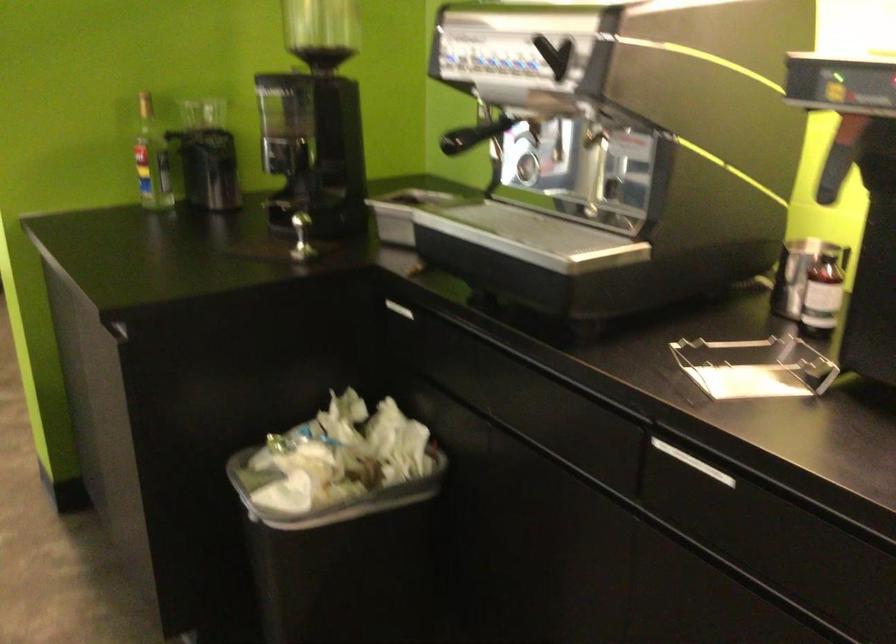
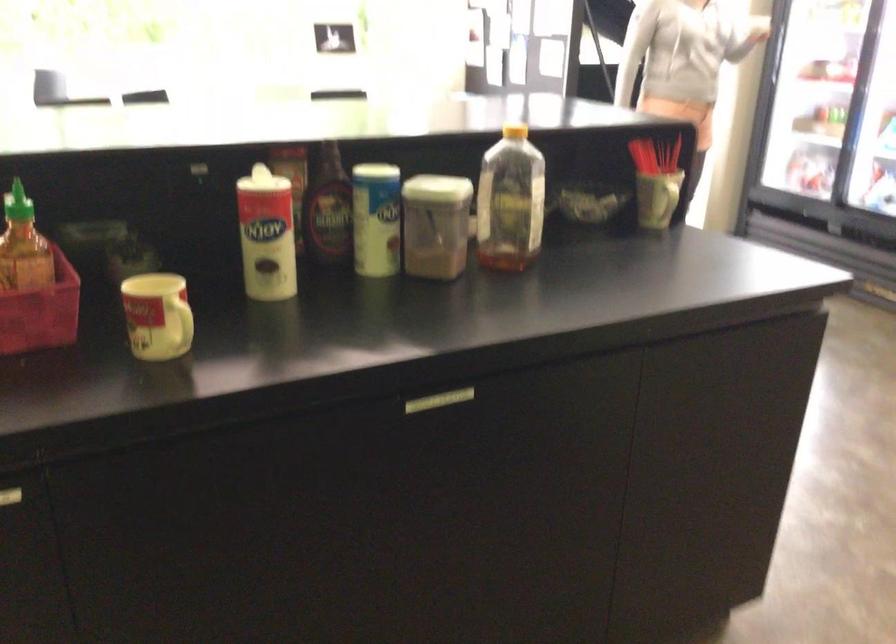
First-person continuous shooting, in which direction is the camera rotating?

The camera's rotation is toward left-down.